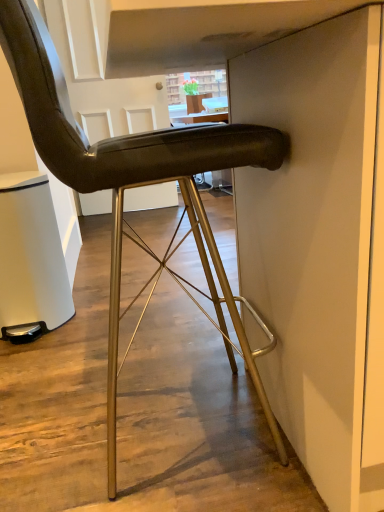
This screenshot has height=512, width=384. I want to click on free area below matte black chair at center (from a real-world perspective), so click(134, 431).